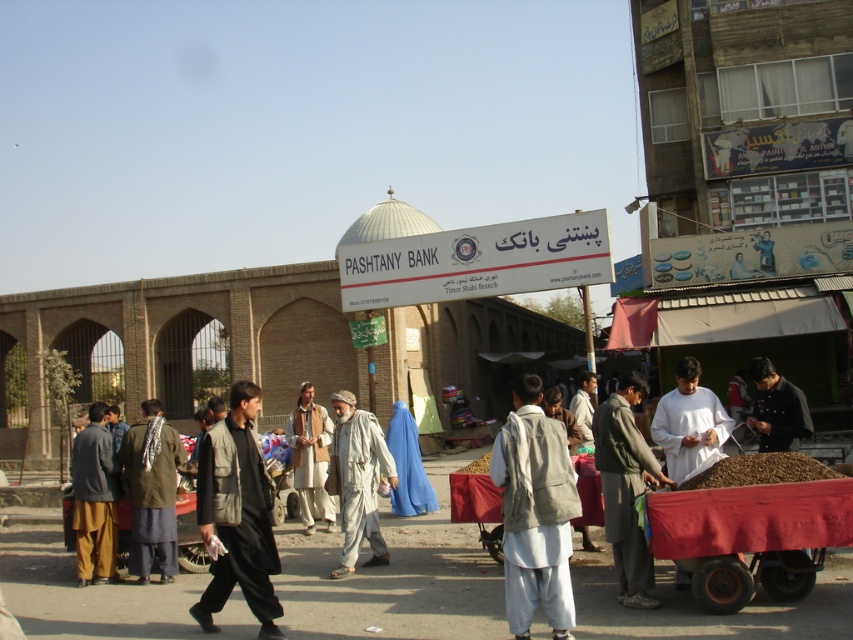
You are a delivery person trying to navigate through the bustling marketplace. You need to reach the dark gray fabric cart at lower right. Which direction should you move relative to your current position at point A?

The dark gray fabric cart at lower right is located at point (625,488), so you should move towards the lower right direction from point A to reach it.

You are standing in the bustling street scene and want to take a photo of both the point at coordinates point (229, 584) and point (662, 422). Which point should you focus on first to ensure both are in clear view?

You should focus on point (229, 584) first because it is closer to the camera than point (662, 422). This ensures both points are in focus as the depth of field will cover the farther point when focusing on the closer one.